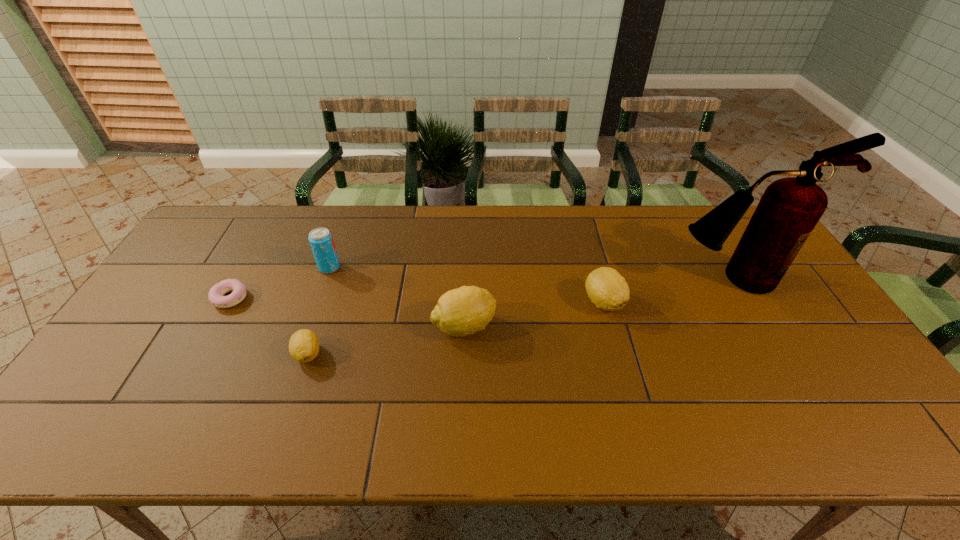
You are a GUI agent. You are given a task and a screenshot of the screen. Output one action in this format:
    pyautogui.click(x=<x>, y=<y>)
    Task: Click on the shortest lemon
    
    Given the screenshot: What is the action you would take?
    pyautogui.click(x=304, y=345)

At what (x,y) coordinates should I click in order to perform the action: click on the fifth tallest object. Please return your answer as a coordinate pair (x, y). Looking at the image, I should click on (304, 345).

Locate an element on the screen. This screenshot has width=960, height=540. the second lemon from right to left is located at coordinates (463, 311).

What are the coordinates of `the third shortest object` in the screenshot? It's located at (607, 289).

At what (x,y) coordinates should I click in order to perform the action: click on the rightmost lemon. Please return your answer as a coordinate pair (x, y). The image size is (960, 540). Looking at the image, I should click on (607, 289).

I want to click on soda can, so click(321, 241).

Image resolution: width=960 pixels, height=540 pixels. What are the coordinates of `fire extinguisher` in the screenshot? It's located at (790, 208).

Image resolution: width=960 pixels, height=540 pixels. In order to click on the rightmost object in this screenshot , I will do `click(790, 208)`.

The width and height of the screenshot is (960, 540). What are the coordinates of `doughnut` in the screenshot? It's located at (216, 293).

Locate an element on the screen. This screenshot has height=540, width=960. the shortest object is located at coordinates click(x=216, y=293).